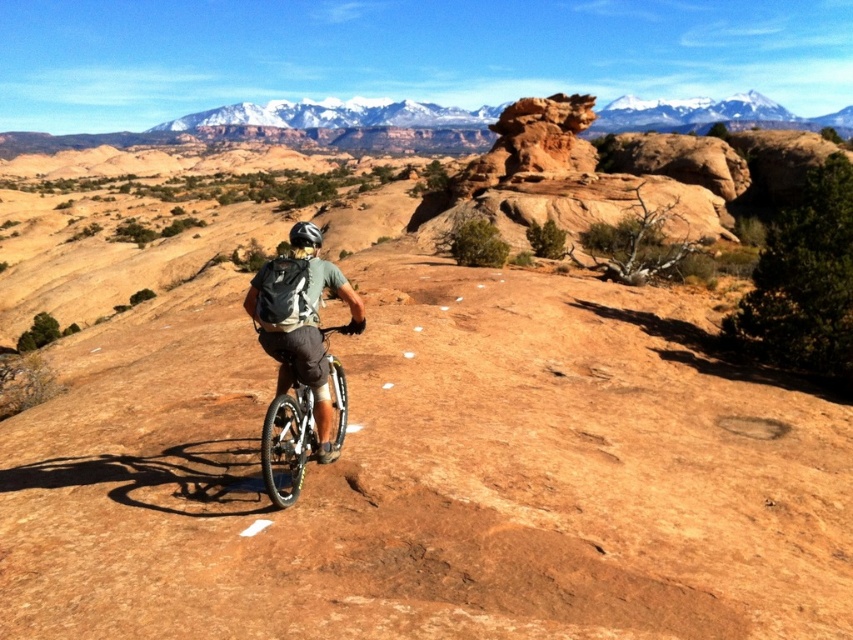
You are a drone operator trying to capture the mountain biker in the desert landscape. You need to adjust your camera to focus on both the point at (x=314, y=426) and the point at (x=306, y=244). Which point should you focus on first to ensure both are in clear view?

You should focus on point (x=314, y=426) first because it is closer to the camera than point (x=306, y=244). By focusing on the closer point, the farther point will also be in focus due to the depth of field.

You are a mountain biker navigating a desert trail. You notice a matte gray backpack at center and a silver metallic bicycle at center. Which object is closer to you, the observer?

The matte gray backpack at center is closer to you because the silver metallic bicycle at center is positioned behind it.

You are a drone operator trying to capture aerial footage of the mountain biker. You have two points marked on your screen for camera positioning. Point A is at coordinates point (310, 276) and Point B is at point (339, 442). Which point should you choose to get a clear shot of the biker without any obstructions?

Point A at point (310, 276) is in front of point (339, 442), so choosing Point A will provide a clearer view of the biker without obstructions from the background terrain.